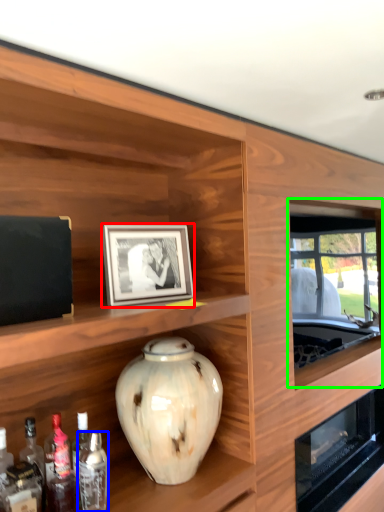
Question: Which object is positioned farthest from picture frame (highlighted by a red box)? Select from bottle (highlighted by a blue box) and window (highlighted by a green box).

Choices:
 (A) bottle
 (B) window

Answer: (B)